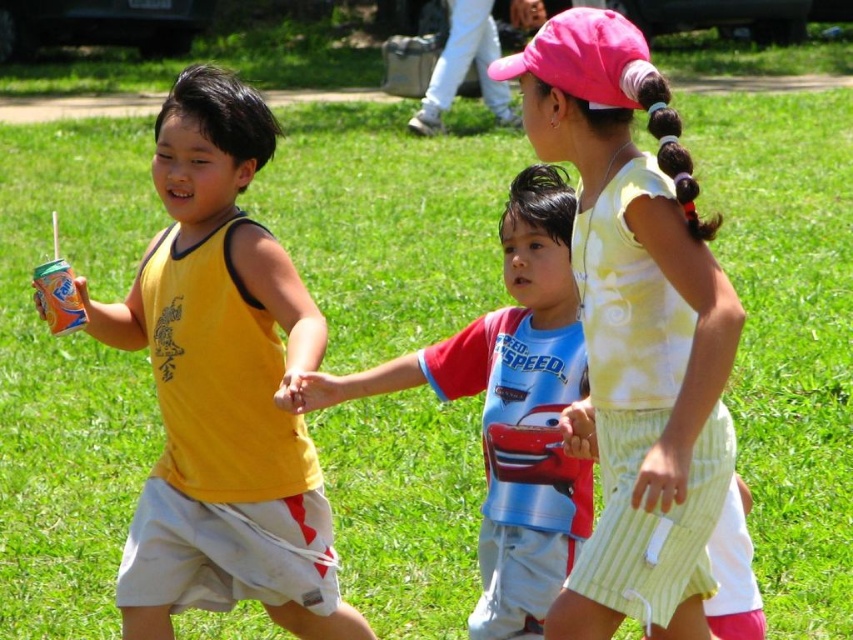
Question: Observing the image, what is the correct spatial positioning of yellow sleeveless shirt at left in reference to red and blue cotton shirt at center?

Choices:
 (A) below
 (B) above

Answer: (B)

Question: Does yellow sleeveless shirt at left appear on the left side of light yellow tie-dye shirt at center?

Choices:
 (A) yes
 (B) no

Answer: (A)

Question: Among these objects, which one is farthest from the camera?

Choices:
 (A) light yellow tie-dye shirt at center
 (B) red and blue cotton shirt at center
 (C) yellow sleeveless shirt at left

Answer: (B)

Question: Which object is farther from the camera taking this photo?

Choices:
 (A) light yellow tie-dye shirt at center
 (B) red and blue cotton shirt at center
 (C) yellow sleeveless shirt at left

Answer: (B)

Question: Which object appears farthest from the camera in this image?

Choices:
 (A) yellow sleeveless shirt at left
 (B) red and blue cotton shirt at center

Answer: (B)

Question: Is light yellow tie-dye shirt at center further to the viewer compared to red and blue cotton shirt at center?

Choices:
 (A) yes
 (B) no

Answer: (B)